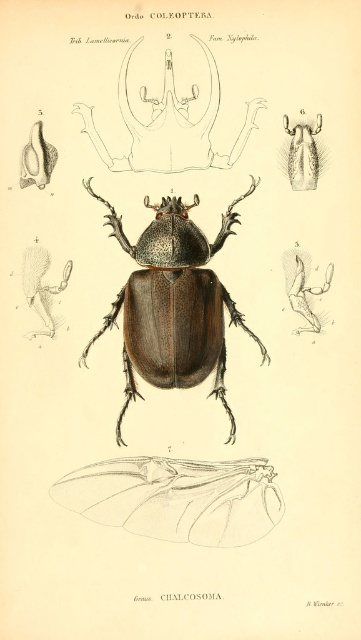
Based on the scientific illustration of the Chalcosoma beetle, where is the transparent paper wing at lower center positioned relative to the beetle?

A: The transparent paper wing at lower center is positioned at point coordinates 0.780 on the x axis and 0.490 on the y axis.

You are an entomologist examining the beetle illustration. You notice the matte black mandibles at upper center and the fuzzy brown wing at upper center. Which of these two features is positioned closer to your viewpoint?

The matte black mandibles at upper center are closer to the viewer than the fuzzy brown wing at upper center, as indicated by their spatial arrangement in the illustration.

Based on the illustration, which of the two wings, the transparent paper wing at lower center or the fuzzy brown wing at upper center, has a greater width?

The transparent paper wing at lower center has a greater width than the fuzzy brown wing at upper center according to the illustration.